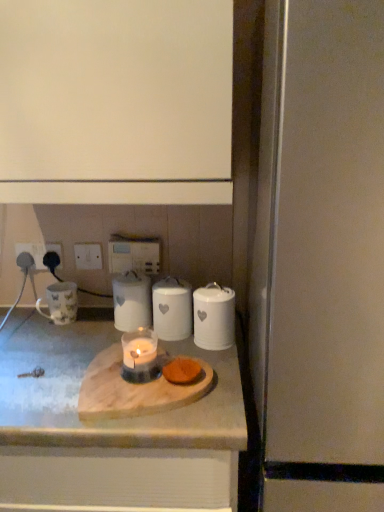
You are a GUI agent. You are given a task and a screenshot of the screen. Output one action in this format:
    pyautogui.click(x=<x>, y=<y>)
    Task: Click on the free spot in front of white ceramic jar at right, the second appliance when ordered from right to left
    
    Given the screenshot: What is the action you would take?
    pyautogui.click(x=219, y=371)